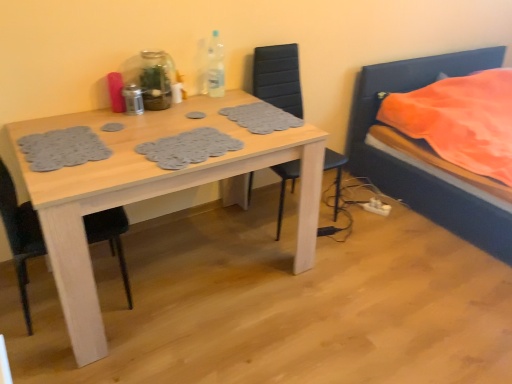
Identify the location of spots to the right of black leather chair at center, marked as the 2th chair in a left-to-right arrangement. This screenshot has width=512, height=384. (367, 219).